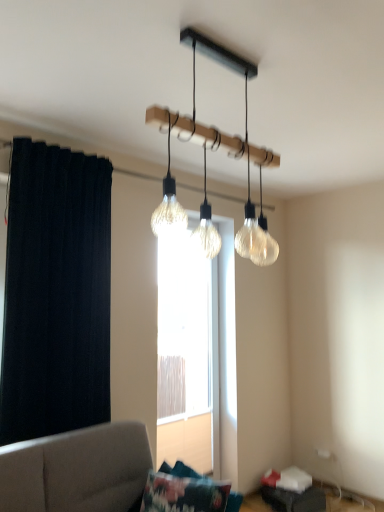
Question: From the image's perspective, is clear glass light fixture at upper center below fluffy fabric pillow at lower center?

Choices:
 (A) yes
 (B) no

Answer: (B)

Question: Can you confirm if clear glass light fixture at upper center is positioned to the right of fluffy fabric pillow at lower center?

Choices:
 (A) no
 (B) yes

Answer: (B)

Question: Considering the relative sizes of clear glass light fixture at upper center and fluffy fabric pillow at lower center in the image provided, is clear glass light fixture at upper center wider than fluffy fabric pillow at lower center?

Choices:
 (A) no
 (B) yes

Answer: (B)

Question: Can you confirm if clear glass light fixture at upper center is bigger than fluffy fabric pillow at lower center?

Choices:
 (A) no
 (B) yes

Answer: (B)

Question: Is clear glass light fixture at upper center oriented away from fluffy fabric pillow at lower center?

Choices:
 (A) yes
 (B) no

Answer: (B)

Question: Is clear glass light fixture at upper center at the left side of fluffy fabric pillow at lower center?

Choices:
 (A) no
 (B) yes

Answer: (A)

Question: From a real-world perspective, is clear glass light fixture at upper center on top of dark fabric curtain at left?

Choices:
 (A) no
 (B) yes

Answer: (B)

Question: Is clear glass light fixture at upper center aimed at dark fabric curtain at left?

Choices:
 (A) no
 (B) yes

Answer: (A)

Question: Does clear glass light fixture at upper center have a larger size compared to dark fabric curtain at left?

Choices:
 (A) no
 (B) yes

Answer: (B)

Question: Does clear glass light fixture at upper center have a lesser height compared to dark fabric curtain at left?

Choices:
 (A) yes
 (B) no

Answer: (A)

Question: Is clear glass light fixture at upper center looking in the opposite direction of dark fabric curtain at left?

Choices:
 (A) no
 (B) yes

Answer: (B)

Question: Can dark fabric curtain at left be found inside clear glass light fixture at upper center?

Choices:
 (A) no
 (B) yes

Answer: (A)

Question: Can you confirm if clear glass light fixture at upper center is bigger than translucent glass window at center?

Choices:
 (A) yes
 (B) no

Answer: (B)